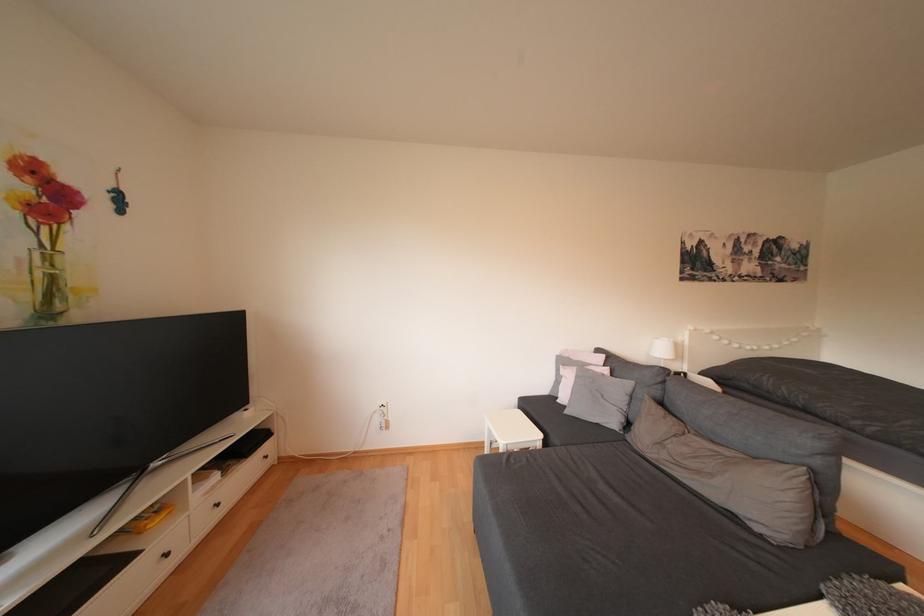
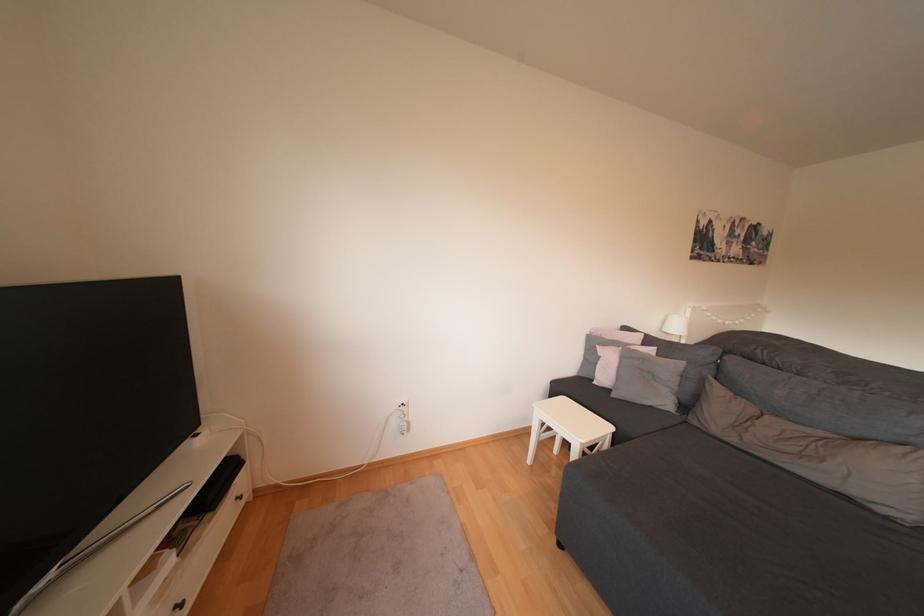
Which direction would the cameraman need to move to produce the second image?

The cameraman moved toward left, forward.